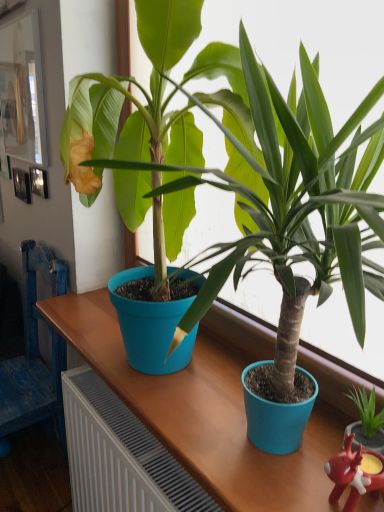
Question: Is blue fabric chair at left shorter than white glossy picture frame at upper left?

Choices:
 (A) no
 (B) yes

Answer: (A)

Question: Is the position of blue fabric chair at left less distant than that of white glossy picture frame at upper left?

Choices:
 (A) yes
 (B) no

Answer: (A)

Question: From the image's perspective, does blue fabric chair at left appear lower than white glossy picture frame at upper left?

Choices:
 (A) no
 (B) yes

Answer: (B)

Question: Considering the relative positions of blue fabric chair at left and white glossy picture frame at upper left in the image provided, is blue fabric chair at left to the left of white glossy picture frame at upper left from the viewer's perspective?

Choices:
 (A) yes
 (B) no

Answer: (A)

Question: Does blue fabric chair at left have a lesser width compared to white glossy picture frame at upper left?

Choices:
 (A) no
 (B) yes

Answer: (A)

Question: Is point (1, 394) positioned closer to the camera than point (21, 122)?

Choices:
 (A) closer
 (B) farther

Answer: (A)

Question: Is blue fabric chair at left inside the boundaries of white glossy picture frame at upper left, or outside?

Choices:
 (A) inside
 (B) outside

Answer: (B)

Question: Is blue fabric chair at left in front of or behind white glossy picture frame at upper left in the image?

Choices:
 (A) front
 (B) behind

Answer: (A)

Question: From their relative heights in the image, would you say blue fabric chair at left is taller or shorter than white glossy picture frame at upper left?

Choices:
 (A) tall
 (B) short

Answer: (A)

Question: Would you say rubberized red reindeer at lower right is to the left or to the right of blue fabric chair at left in the picture?

Choices:
 (A) right
 (B) left

Answer: (A)

Question: From a real-world perspective, relative to blue fabric chair at left, is rubberized red reindeer at lower right vertically above or below?

Choices:
 (A) above
 (B) below

Answer: (A)

Question: Considering their positions, is rubberized red reindeer at lower right located in front of or behind blue fabric chair at left?

Choices:
 (A) front
 (B) behind

Answer: (A)

Question: Choose the correct answer: Is rubberized red reindeer at lower right inside blue fabric chair at left or outside it?

Choices:
 (A) outside
 (B) inside

Answer: (A)

Question: Based on their sizes in the image, would you say white glossy picture frame at upper left is bigger or smaller than blue fabric chair at left?

Choices:
 (A) big
 (B) small

Answer: (B)

Question: Considering their positions, is white glossy picture frame at upper left located in front of or behind blue fabric chair at left?

Choices:
 (A) front
 (B) behind

Answer: (B)